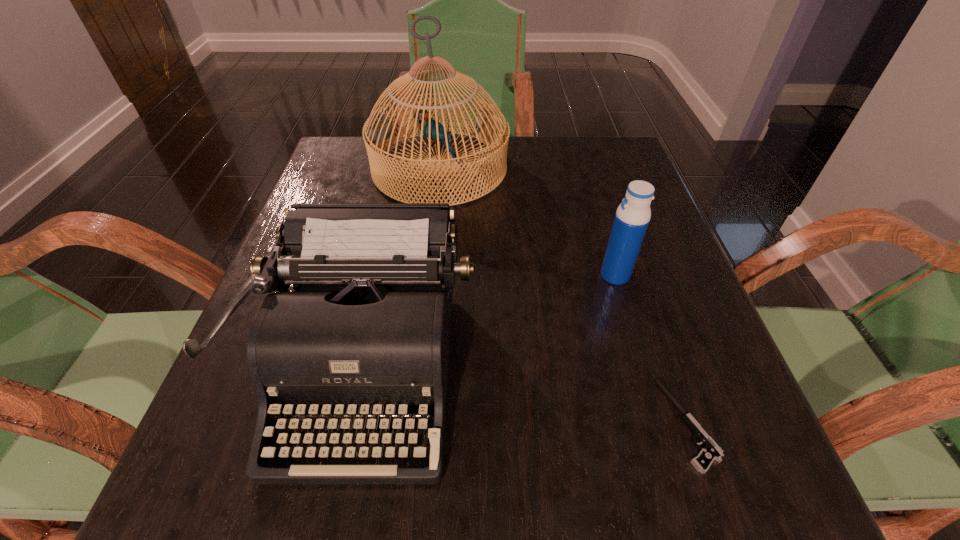
The width and height of the screenshot is (960, 540). I want to click on free space between the shortest object and the typewriter, so click(527, 394).

Identify the location of empty space that is in between the shortest object and the typewriter. This screenshot has height=540, width=960. (527, 394).

Find the location of a particular element. The height and width of the screenshot is (540, 960). vacant space in between the tallest object and the shortest object is located at coordinates [564, 296].

At what (x,y) coordinates should I click in order to perform the action: click on unoccupied position between the tallest object and the pistol. Please return your answer as a coordinate pair (x, y). This screenshot has height=540, width=960. Looking at the image, I should click on (564, 296).

The height and width of the screenshot is (540, 960). Identify the location of vacant space in between the water bottle and the typewriter. (491, 320).

Where is `the second closest object to the water bottle`? This screenshot has height=540, width=960. the second closest object to the water bottle is located at coordinates pyautogui.click(x=365, y=331).

Choose which object is the nearest neighbor to the farthest object. Please provide its 2D coordinates. Your answer should be formatted as a tuple, i.e. [(x, y)], where the tuple contains the x and y coordinates of a point satisfying the conditions above.

[(365, 331)]

This screenshot has height=540, width=960. In order to click on free space that satisfies the following two spatial constraints: 1. on the front side of the water bottle; 2. on the left side of the tallest object in this screenshot , I will do `click(427, 275)`.